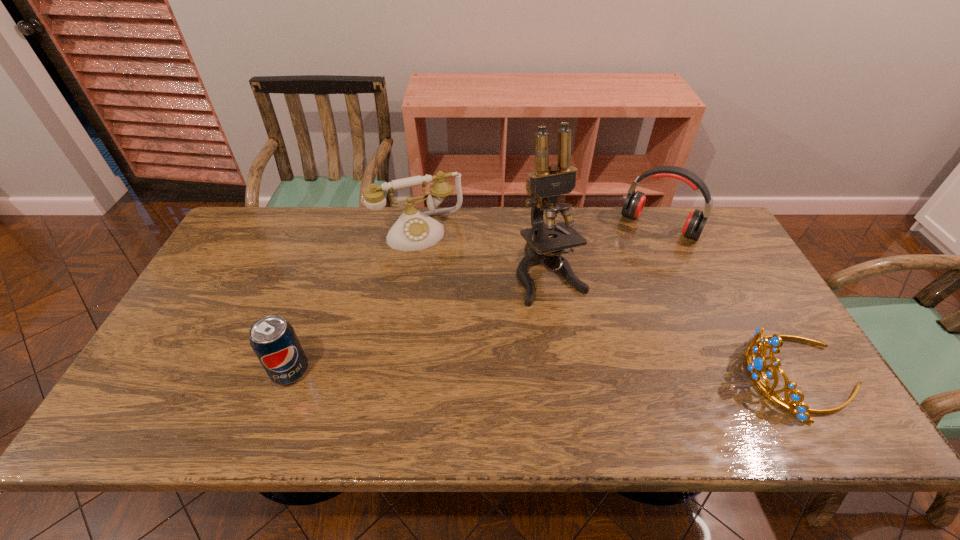
This screenshot has width=960, height=540. Find the location of `free space located 0.110m at the eyepieces of the microscope`. free space located 0.110m at the eyepieces of the microscope is located at coordinates (584, 336).

This screenshot has width=960, height=540. Identify the location of free point located at the eyepieces of the microscope. (613, 389).

Find the location of `vacant space located at the eyepieces of the microscope`. vacant space located at the eyepieces of the microscope is located at coordinates (584, 336).

I want to click on free space located on the dial of the telephone, so click(x=448, y=293).

Identify the location of vacant region located on the dial of the telephone. (470, 347).

Locate an element on the screen. Image resolution: width=960 pixels, height=540 pixels. blank space located 0.390m on the dial of the telephone is located at coordinates (470, 347).

This screenshot has width=960, height=540. In order to click on blank area located 0.190m on the ear cups of the earphone in this screenshot , I will do `click(626, 278)`.

The width and height of the screenshot is (960, 540). I want to click on vacant space situated on the ear cups of the earphone, so click(x=636, y=261).

You are a GUI agent. You are given a task and a screenshot of the screen. Output one action in this format:
    pyautogui.click(x=<x>, y=<y>)
    Task: Click on the vacant space located on the ear cups of the earphone
    
    Given the screenshot: What is the action you would take?
    pyautogui.click(x=610, y=307)

Locate an element on the screen. microscope that is positioned at the far edge is located at coordinates (549, 181).